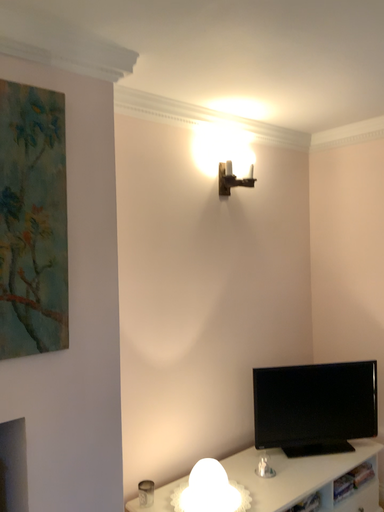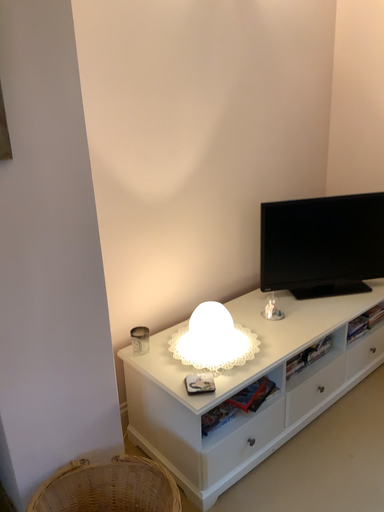
Question: How did the camera likely rotate when shooting the video?

Choices:
 (A) rotated downward
 (B) rotated upward

Answer: (A)